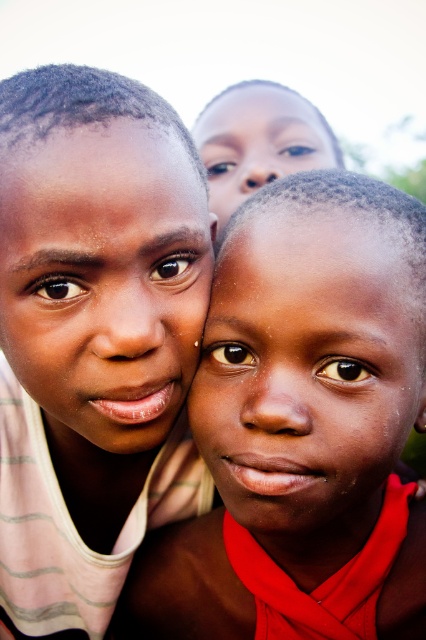
Looking at the three children in the scene, which child has their face positioned to the left of the other? Specifically, between the matte skin face at center and the smooth skin face at upper center, which one is located to the left?

The matte skin face at center is positioned to the left of the smooth skin face at upper center.

Looking at the three children in the scene, you notice two children with smooth skin. The first is labeled as the smooth skin child at center and the second as the smooth skin face at center. Which of these two has a larger size in the image?

The smooth skin child at center is much taller than the smooth skin face at center, so the smooth skin child at center is larger in size.